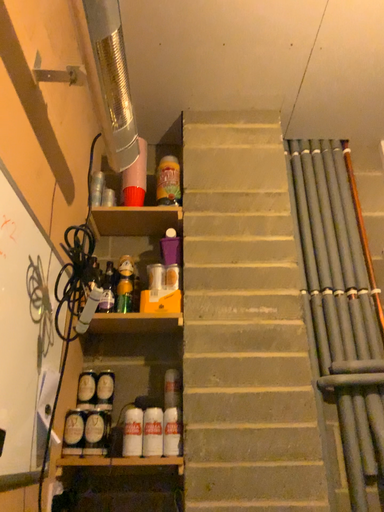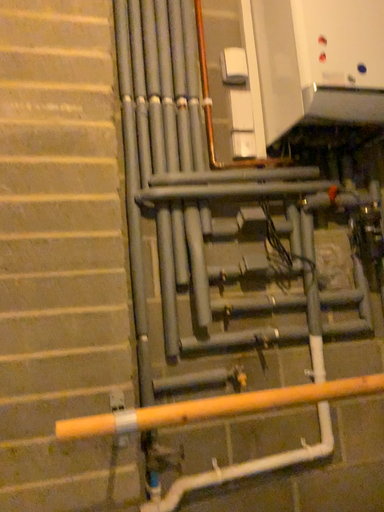
Question: How did the camera likely rotate when shooting the video?

Choices:
 (A) rotated upward
 (B) rotated downward

Answer: (B)